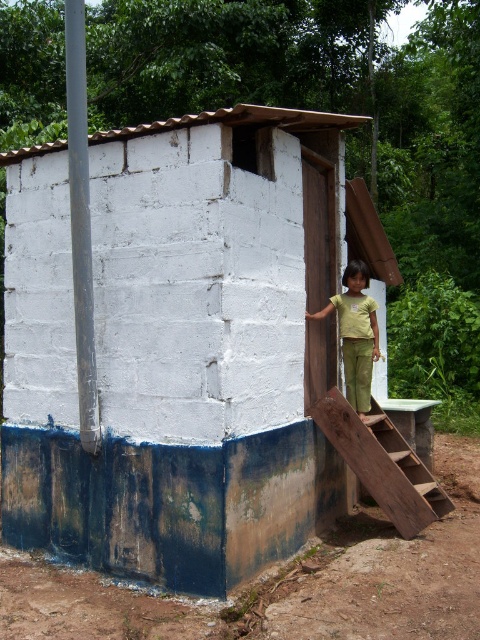
You are a maintenance worker tasked with inspecting the white painted concrete hut at center and the wooden stairs at right. Which object requires more time to inspect due to its size?

The white painted concrete hut at center requires more time to inspect because it has a larger size compared to the wooden stairs at right.

You are a photographer trying to capture the white painted concrete hut at center and the green cotton pants at right in the same frame. Based on their positions, which object should you focus on first to ensure both are in focus?

Since the white painted concrete hut at center is closer to the viewer than the green cotton pants at right, you should focus on the white painted concrete hut at center first to ensure both are in focus.

You are standing 15 feet away from the latrine. There is a point at coordinates (405, 509). Is that point closer to you than the latrine?

The distance of point (405, 509) from viewer is 20.09 feet, so the point is farther away than the latrine which you are 15 feet away from.